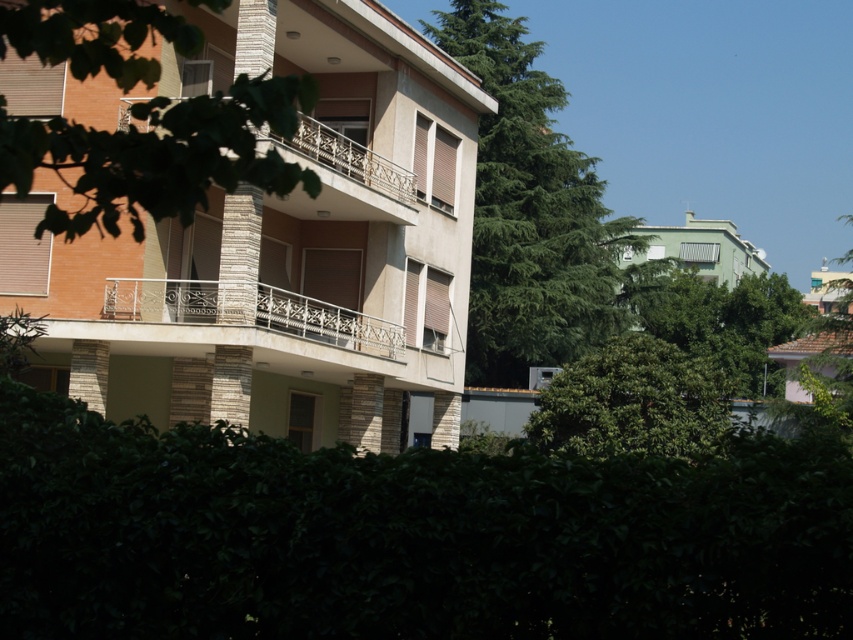
Question: Observing the image, what is the correct spatial positioning of green leafy hedge at center in reference to green leafy tree at right?

Choices:
 (A) above
 (B) below

Answer: (B)

Question: Does green coniferous tree at center have a smaller size compared to green leafy tree at upper center?

Choices:
 (A) no
 (B) yes

Answer: (A)

Question: Which point is closer to the camera taking this photo?

Choices:
 (A) 357,145
 (B) 550,404

Answer: (A)

Question: Is green coniferous tree at center to the right of green leafy hedge at center from the viewer's perspective?

Choices:
 (A) yes
 (B) no

Answer: (B)

Question: Which of these objects is positioned farthest from the green coniferous tree at center?

Choices:
 (A) green leafy hedge at lower center
 (B) green leafy hedge at center
 (C) stone textured balcony at center
 (D) green leafy tree at upper center

Answer: (D)

Question: Which point appears farthest from the camera in this image?

Choices:
 (A) coord(578,188)
 (B) coord(740,288)
 (C) coord(631,404)

Answer: (B)